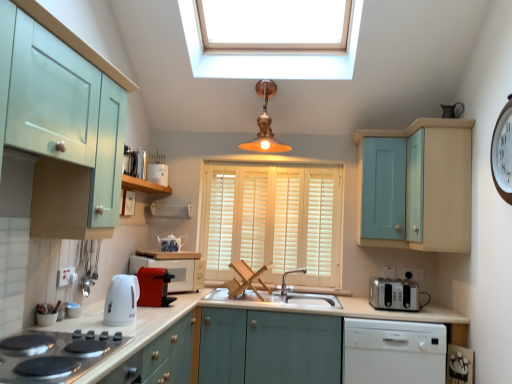
Question: From the image's perspective, is matte red microwave at center, which is counted as the 2th appliance, starting from the right, above or below silver metallic faucet at center?

Choices:
 (A) below
 (B) above

Answer: (B)

Question: Is matte red microwave at center, which is counted as the 2th appliance, starting from the right, bigger or smaller than silver metallic faucet at center?

Choices:
 (A) small
 (B) big

Answer: (B)

Question: Based on their relative distances, which object is nearer to the wooden shelf at upper left?

Choices:
 (A) white wood blinds at center
 (B) white ceramic toaster at center, which appears as the second appliance when viewed from the left
 (C) teal wooden cabinet at upper right
 (D) matte black toaster at upper left, positioned as the first appliance in top-to-bottom order
 (E) matte red microwave at center, arranged as the 3th appliance when viewed from the left

Answer: (B)

Question: Considering the real-world distances, which object is farthest from the red plastic coffee machine at center?

Choices:
 (A) white plastic dishwasher at lower right
 (B) white ceramic toaster at center, which appears as the second appliance when viewed from the left
 (C) matte teal cabinet at center, placed as the 2th cabinetry when sorted from left to right
 (D) black glass cooktop at lower left
 (E) matte light blue cabinet at left, which is counted as the 3th cabinetry, starting from the right

Answer: (A)